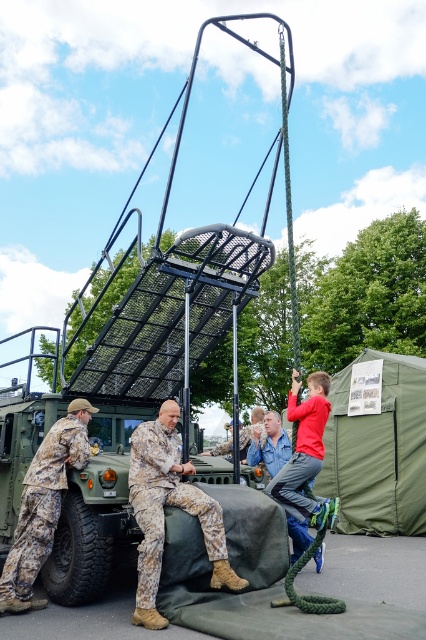
Question: Can you confirm if camouflage fabric pants at center is positioned below camouflage fabric soldier at lower left?

Choices:
 (A) no
 (B) yes

Answer: (A)

Question: Can you confirm if green canvas tent at right is wider than camouflage fabric pants at center?

Choices:
 (A) no
 (B) yes

Answer: (B)

Question: Estimate the real-world distances between objects in this image. Which object is farther from the camouflage fabric soldier at lower left?

Choices:
 (A) green canvas tent at right
 (B) camouflage fabric pants at center

Answer: (A)

Question: Which point is closer to the camera taking this photo?

Choices:
 (A) (388, 428)
 (B) (129, 483)
 (C) (48, 508)

Answer: (B)

Question: Which object appears farthest from the camera in this image?

Choices:
 (A) camouflage fabric soldier at lower left
 (B) green canvas tent at right

Answer: (B)

Question: Is green canvas tent at right smaller than camouflage fabric pants at center?

Choices:
 (A) no
 (B) yes

Answer: (A)